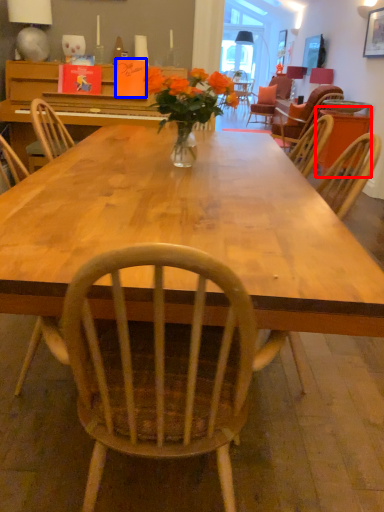
Question: Which point is further to the camera, table (highlighted by a red box) or book (highlighted by a blue box)?

Choices:
 (A) table
 (B) book

Answer: (A)